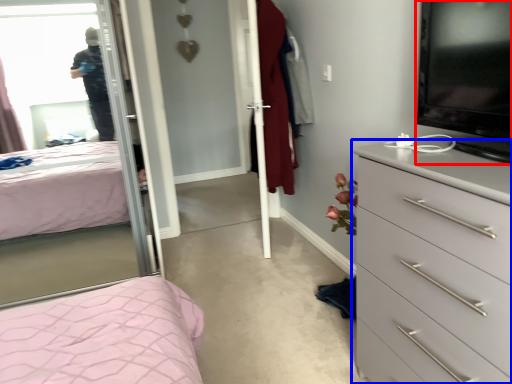
Question: Which object is further to the camera taking this photo, television (highlighted by a red box) or chest of drawers (highlighted by a blue box)?

Choices:
 (A) television
 (B) chest of drawers

Answer: (A)